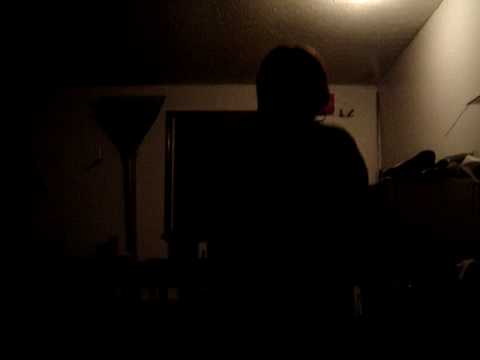
Where is `wall`? The height and width of the screenshot is (360, 480). wall is located at coordinates (442, 92).